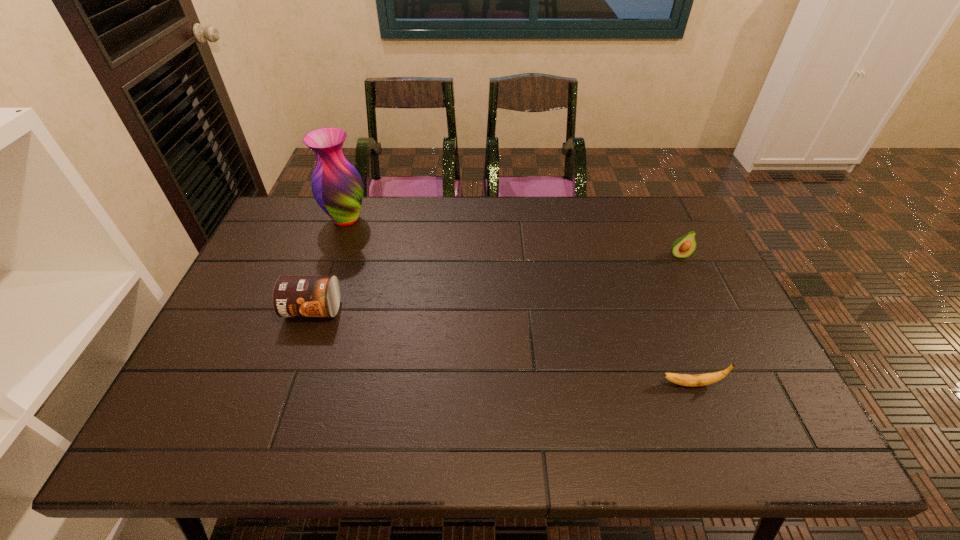
Locate an element on the screen. the farthest object is located at coordinates (337, 187).

The width and height of the screenshot is (960, 540). Find the location of `vase`. vase is located at coordinates (337, 187).

This screenshot has height=540, width=960. What are the coordinates of `can` in the screenshot? It's located at (293, 296).

The image size is (960, 540). Identify the location of avocado. (683, 247).

You are a GUI agent. You are given a task and a screenshot of the screen. Output one action in this format:
    pyautogui.click(x=<x>, y=<y>)
    Task: Click on the rightmost object
    Image resolution: width=960 pixels, height=540 pixels.
    Given the screenshot: What is the action you would take?
    pyautogui.click(x=683, y=247)

Image resolution: width=960 pixels, height=540 pixels. Identify the location of the third object from left to right. (696, 380).

At what (x,y) coordinates should I click in order to perform the action: click on the nearest object. Please return your answer as a coordinate pair (x, y). The image size is (960, 540). Looking at the image, I should click on (696, 380).

Where is `vacant region located 0.080m on the right of the tallest object`? vacant region located 0.080m on the right of the tallest object is located at coordinates (394, 219).

Image resolution: width=960 pixels, height=540 pixels. Identify the location of free space located on the front label of the second nearest object. (295, 360).

Where is `vacant space located 0.260m on the cut side of the rightmost object`? This screenshot has width=960, height=540. vacant space located 0.260m on the cut side of the rightmost object is located at coordinates (712, 327).